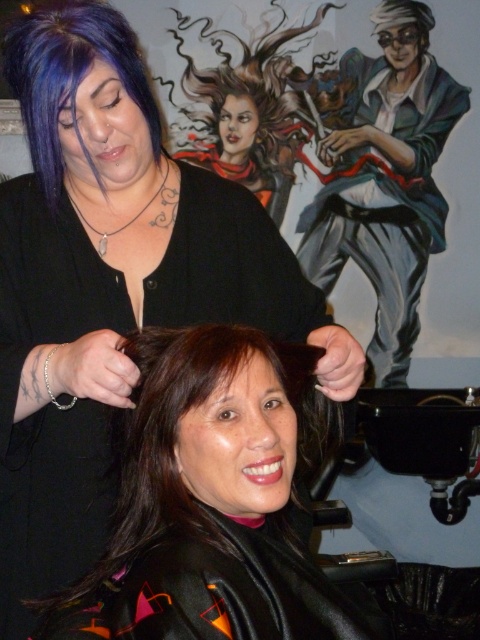
You are a customer in the hair salon and want to choose between the shiny blue jacket at upper right and the purple matte hair at upper left. Which object is wider?

The shiny blue jacket at upper right might be wider than purple matte hair at upper left.

Based on the photo, you are a customer in the salon and want to take a photo of the stylist wearing the shiny blue jacket at upper right. However, the client with brown smooth hair at center is blocking your view. Can you see the jacket through the client?

The brown smooth hair at center is closer to the viewer than the shiny blue jacket at upper right, so the client is blocking your view of the jacket.

You are a customer in a hair salon and want to know if you can comfortably walk between the shiny blue jacket at upper right and the purple matte hair at upper left. Your average walking space requirement is 3 feet. Can you fit through this space?

The distance between the shiny blue jacket at upper right and the purple matte hair at upper left is 6.88 feet, which is more than enough for your 3 feet requirement. Yes, you can comfortably walk between them.